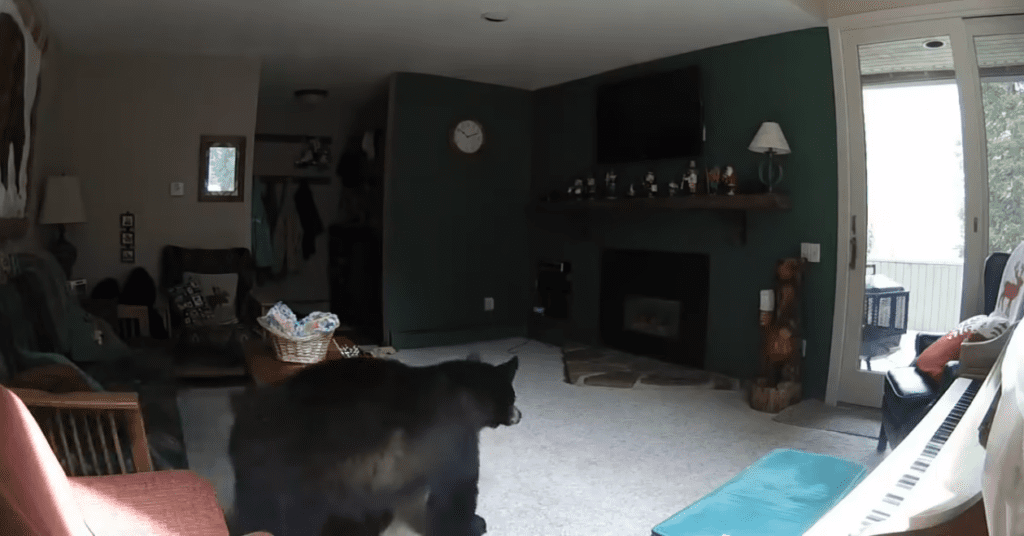
You are a GUI agent. You are given a task and a screenshot of the screen. Output one action in this format:
    pyautogui.click(x=<x>, y=<y>)
    Task: Click on the coat rack
    
    Given the screenshot: What is the action you would take?
    pyautogui.click(x=290, y=202), pyautogui.click(x=303, y=201), pyautogui.click(x=270, y=206), pyautogui.click(x=280, y=180)